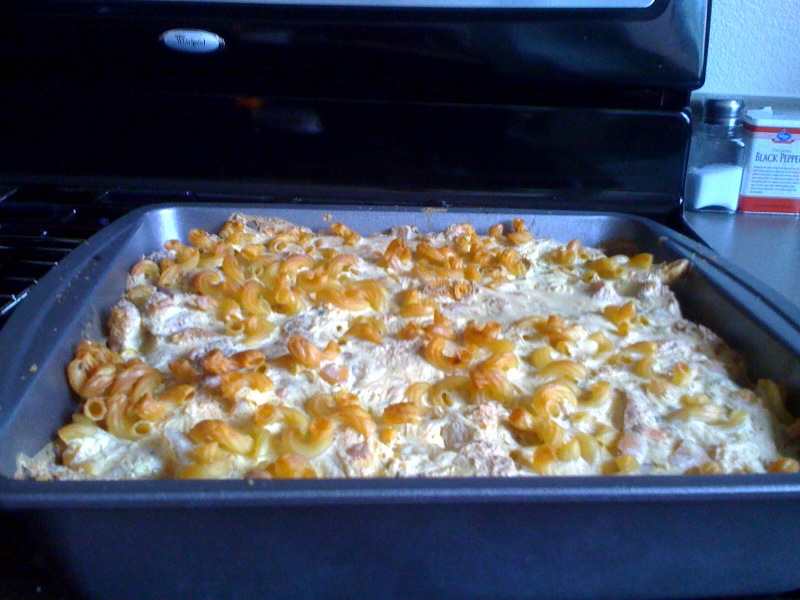
In order to click on oven pan in this screenshot , I will do `click(90, 287)`, `click(380, 539)`, `click(750, 325)`.